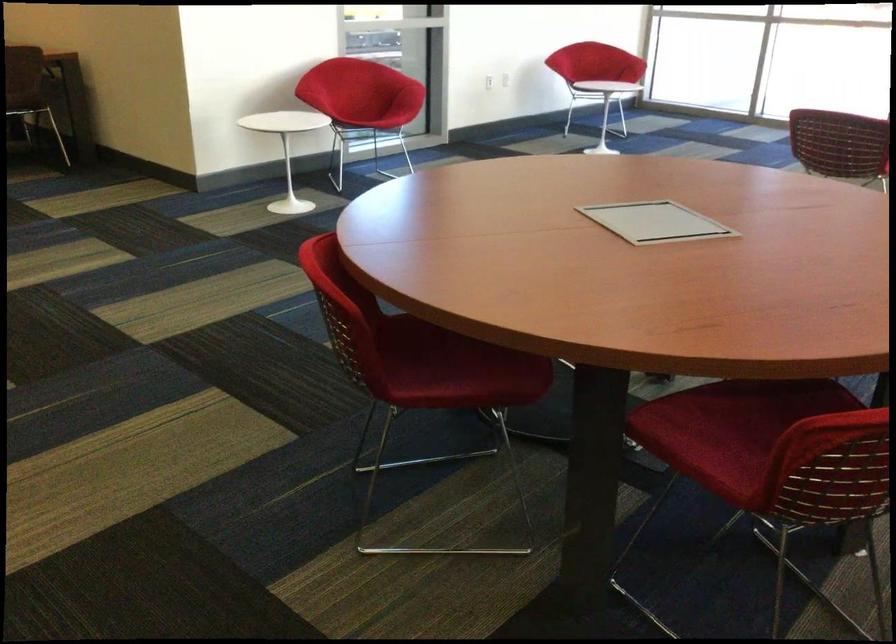
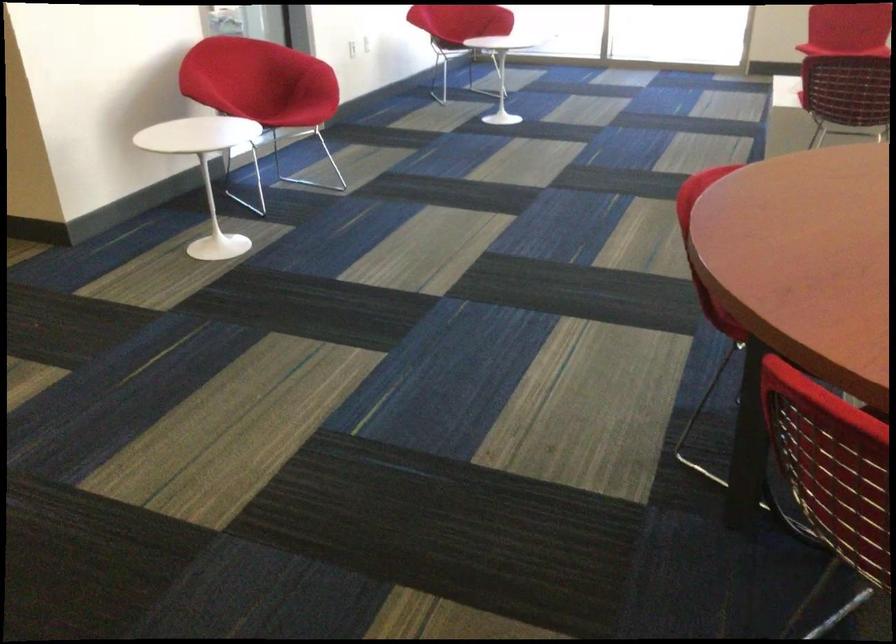
The images are taken continuously from a first-person perspective. In which direction are you moving?

The movement direction of the cameraman is left, forward.